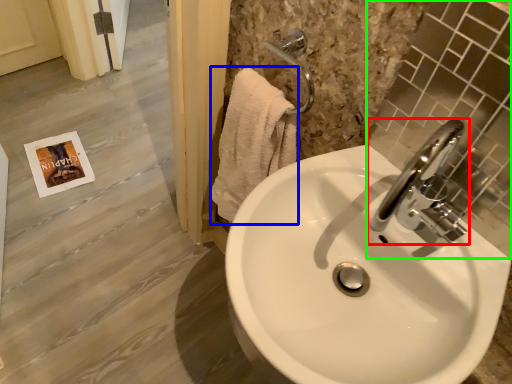
Question: Considering the real-world distances, which object is closest to tap (highlighted by a red box)? bath towel (highlighted by a blue box) or mirror (highlighted by a green box).

Choices:
 (A) bath towel
 (B) mirror

Answer: (B)